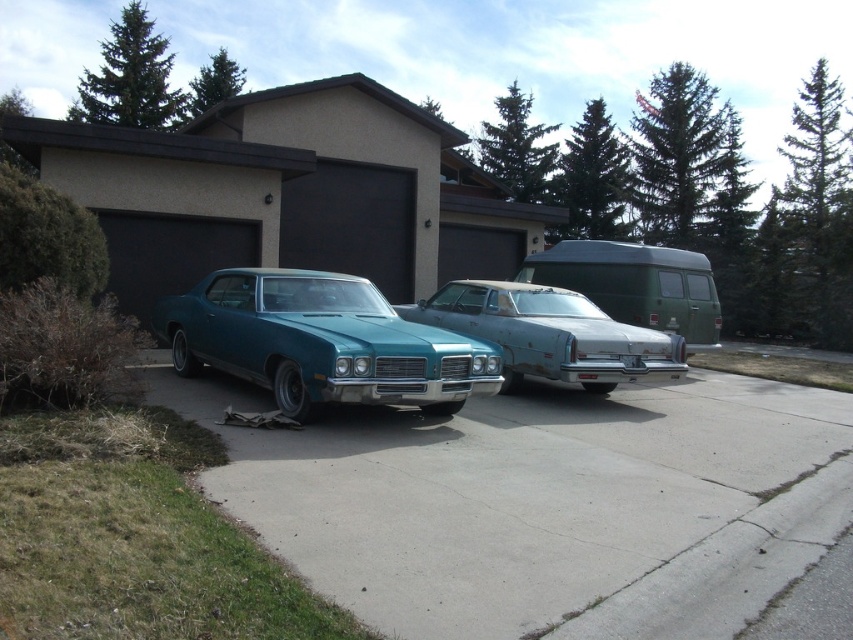
You are a delivery person with a cart that is 5 feet wide. You need to drive your cart through the space between the concrete at center and the teal glossy car at center. Can your cart fit through that space?

The space between the concrete at center and the teal glossy car at center is 4.56 feet. Since your cart is 5 feet wide, it cannot fit through the space as it is slightly narrower than the cart.

In the scene shown: You are standing at the entrance of the driveway and want to walk to the house. There are two points marked on the driveway, point (289, 506) and point (601, 356). Which point should you avoid stepping on if you want to take the shortest path to the house?

You should avoid stepping on point (601, 356) because point (289, 506) is in front of it, so the shortest path to the house would go through point (289, 506) first.

You are standing in the driveway and want to place a new potted plant between the concrete at center and the green matte van at center. Based on their positions, which object should the plant be placed closer to?

The concrete at center is closer to the viewer than the green matte van at center, so the plant should be placed closer to the green matte van at center to be between them.